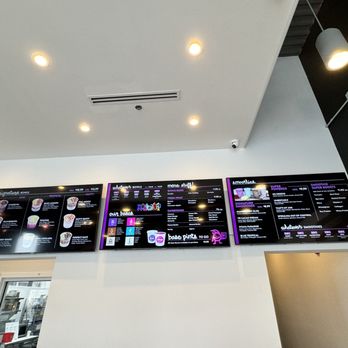
I want to click on doorway, so click(285, 261).